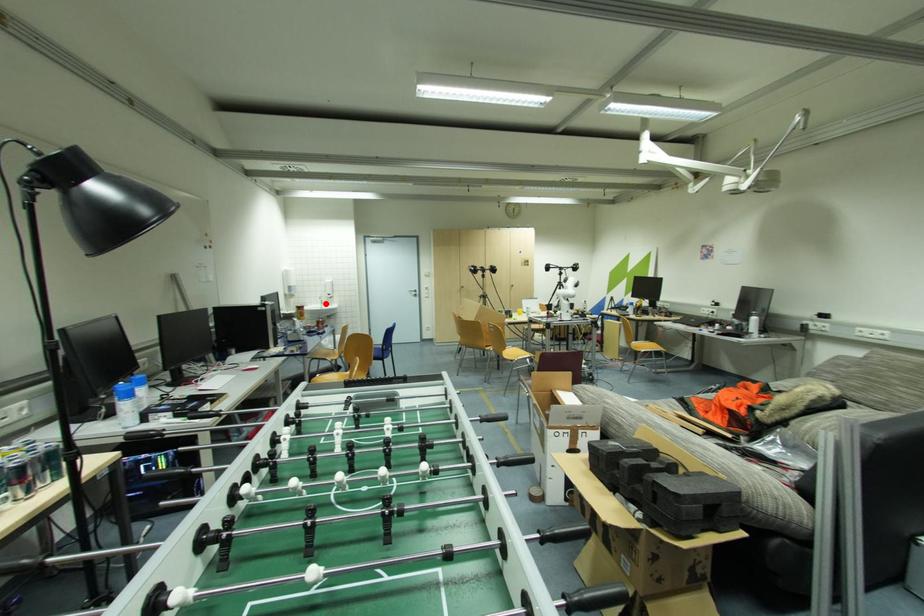
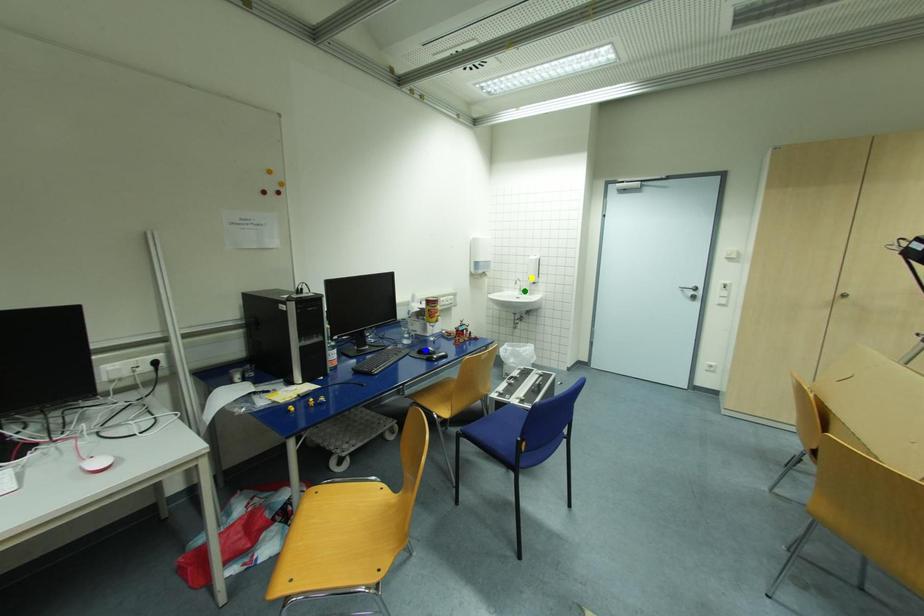
Question: I am providing you with two images of the same scene from different viewpoints. A red point is marked on the first image. You are given multiple points on the second image. In image 2, which mark is for the same physical point as the one in image 1?

Choices:
 (A) blue point
 (B) yellow point
 (C) green point

Answer: (C)